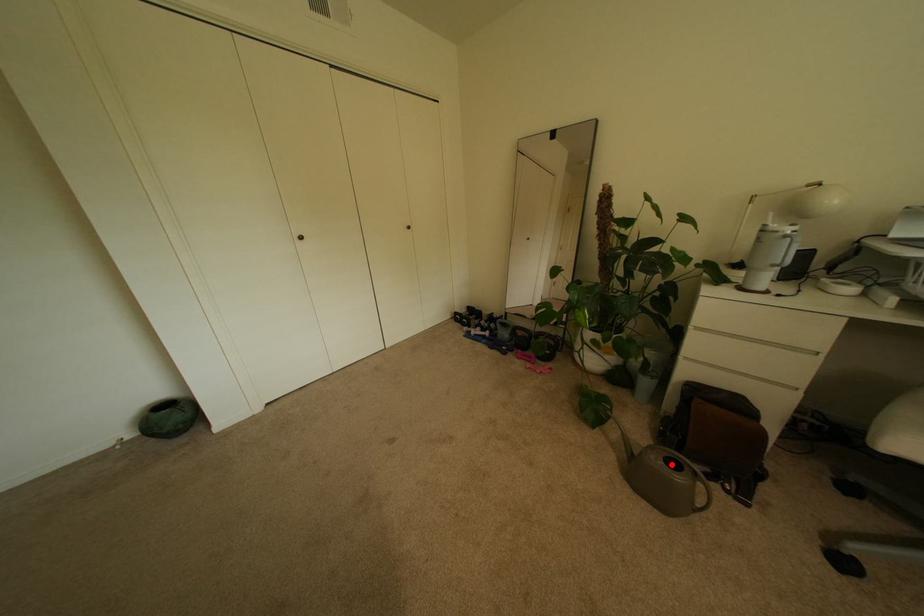
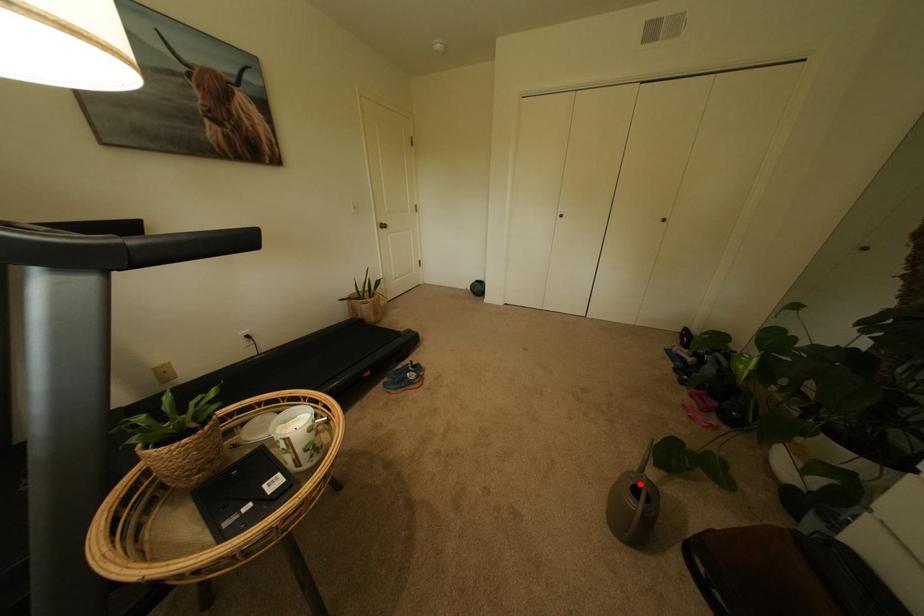
I am providing you with two images of the same scene from different viewpoints. A red point is marked on the first image and another point is marked on the second image. Are the points marked in image1 and image2 representing the same 3D position?

Yes